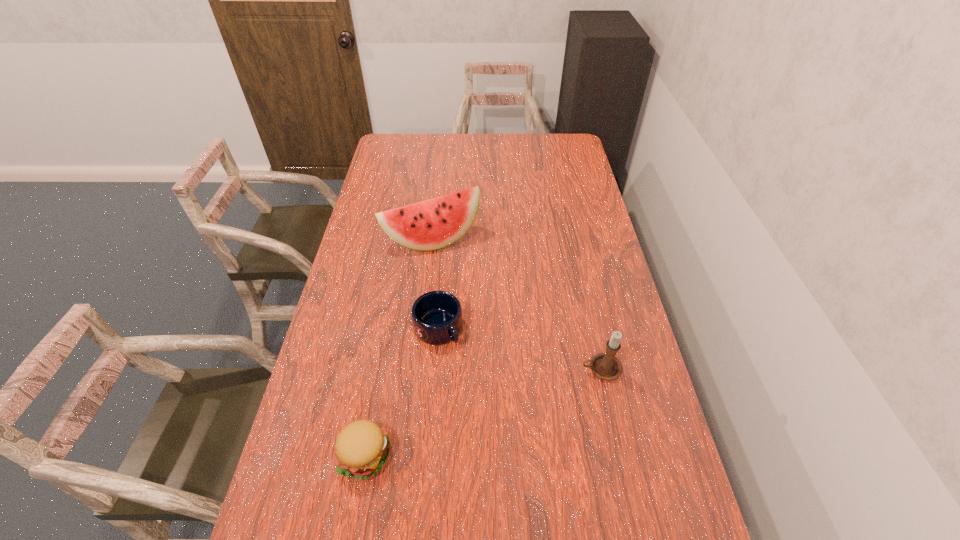
At what (x,y) coordinates should I click in order to perform the action: click on vacant point at the near edge. Please return your answer as a coordinate pair (x, y). Looking at the image, I should click on (395, 519).

Locate an element on the screen. This screenshot has height=540, width=960. vacant space at the left edge is located at coordinates (310, 433).

The width and height of the screenshot is (960, 540). In the image, there is a desktop. Identify the location of vacant space at the right edge. (599, 230).

Where is `vacant area at the far right corner`? This screenshot has width=960, height=540. vacant area at the far right corner is located at coordinates (541, 137).

The image size is (960, 540). In order to click on vacant area that lies between the watermelon and the mug in this screenshot , I will do `click(435, 284)`.

The image size is (960, 540). Identify the location of free area in between the nearest object and the rightmost object. (483, 412).

This screenshot has height=540, width=960. What are the coordinates of `blank region between the candle holder and the tallest object` in the screenshot? It's located at (516, 304).

In order to click on free area in between the second farthest object and the tallest object in this screenshot , I will do `click(435, 284)`.

At what (x,y) coordinates should I click in order to perform the action: click on free spot between the mug and the nearest object. Please return your answer as a coordinate pair (x, y). Looking at the image, I should click on (401, 392).

The width and height of the screenshot is (960, 540). In order to click on vacant space that is in between the rightmost object and the farthest object in this screenshot , I will do `click(516, 304)`.